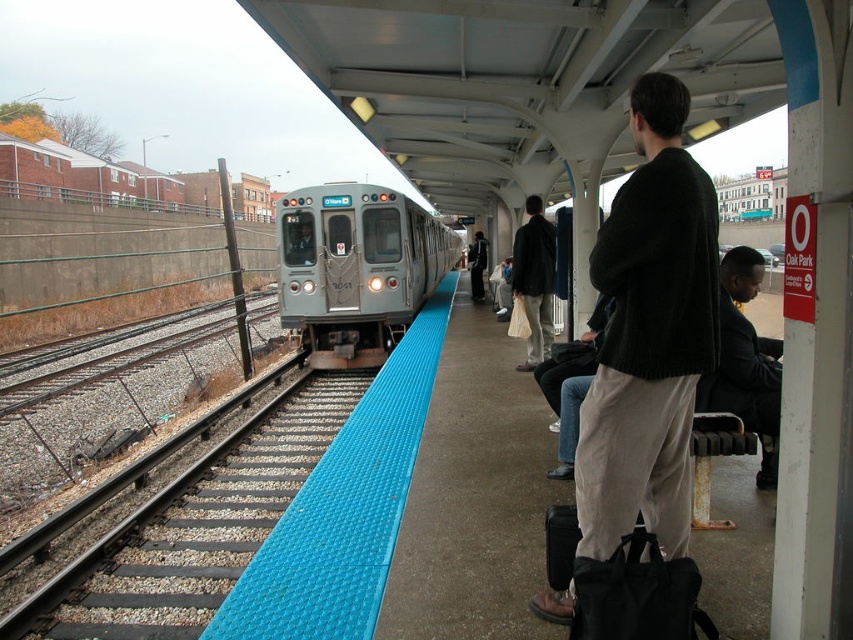
Question: Among these objects, which one is farthest from the camera?

Choices:
 (A) smooth steel tracks at left
 (B) dark gray sweater at center
 (C) matte black jacket at center

Answer: (B)

Question: Does gray metallic train at center appear on the right side of matte black jacket at center?

Choices:
 (A) no
 (B) yes

Answer: (A)

Question: Observing the image, what is the correct spatial positioning of dark suit at right in reference to matte black jacket at center?

Choices:
 (A) left
 (B) right

Answer: (B)

Question: Is dark green sweater at center wider than dark suit at right?

Choices:
 (A) yes
 (B) no

Answer: (A)

Question: Which point is closer to the camera?

Choices:
 (A) matte black jacket at center
 (B) dark gray sweater at center
 (C) smooth steel tracks at left

Answer: (A)

Question: Among these objects, which one is farthest from the camera?

Choices:
 (A) dark gray sweater at center
 (B) smooth steel tracks at left
 (C) dark green sweater at center

Answer: (A)